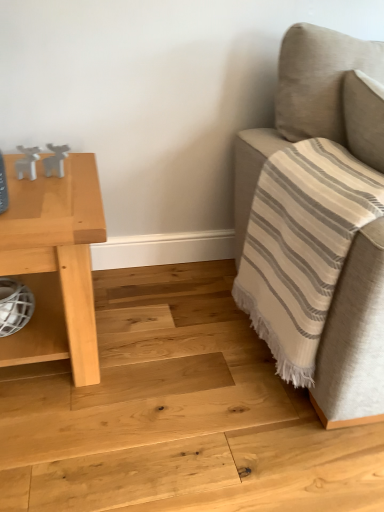
Question: From a real-world perspective, is beige fabric couch at right above or below light wood table at left?

Choices:
 (A) above
 (B) below

Answer: (A)

Question: Considering the positions of beige fabric couch at right and light wood table at left in the image, is beige fabric couch at right bigger or smaller than light wood table at left?

Choices:
 (A) small
 (B) big

Answer: (B)

Question: Which object is the closest to the white mesh basket at lower left?

Choices:
 (A) light wood table at left
 (B) white matte deer at left, positioned as the first toy in left-to-right order
 (C) white matte deer at upper left, the second toy positioned from the left
 (D) beige fabric couch at right

Answer: (A)

Question: Which object is the closest to the white mesh basket at lower left?

Choices:
 (A) light wood table at left
 (B) white matte deer at left, positioned as the first toy in left-to-right order
 (C) white matte deer at upper left, the second toy positioned from the left
 (D) beige fabric couch at right

Answer: (A)